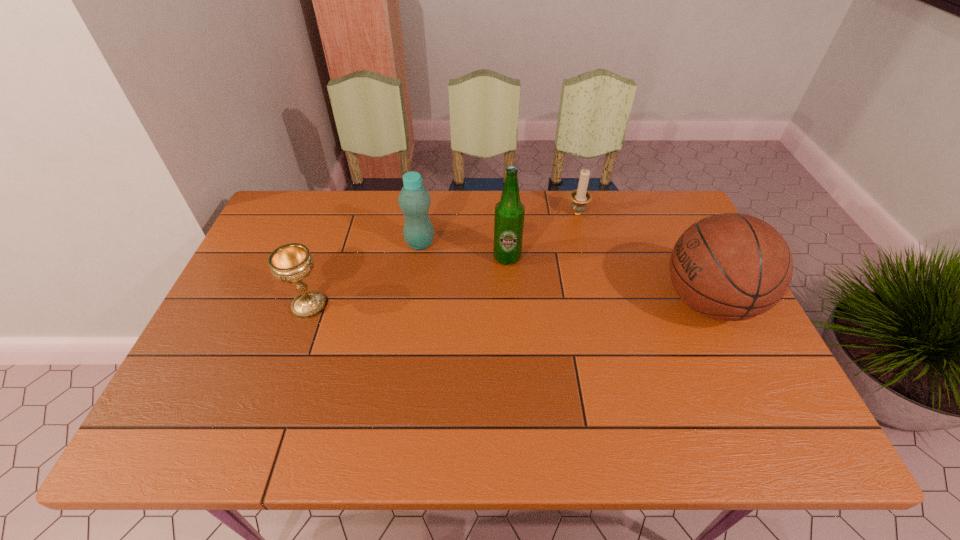
The image size is (960, 540). Find the location of `free spot on the desktop that is between the leftmost object and the basketball and is positioned on the handle side of the farthest object`. free spot on the desktop that is between the leftmost object and the basketball and is positioned on the handle side of the farthest object is located at coordinates (519, 304).

Find the location of `vacant space on the desktop that is between the leftmost object and the rightmost object and is positioned at the front cap of the fourth object from right to left`. vacant space on the desktop that is between the leftmost object and the rightmost object and is positioned at the front cap of the fourth object from right to left is located at coordinates (492, 304).

Where is `vacant space on the desktop that is between the leftmost object and the basketball and is positioned on the label of the beer bottle`? The width and height of the screenshot is (960, 540). vacant space on the desktop that is between the leftmost object and the basketball and is positioned on the label of the beer bottle is located at coordinates (552, 303).